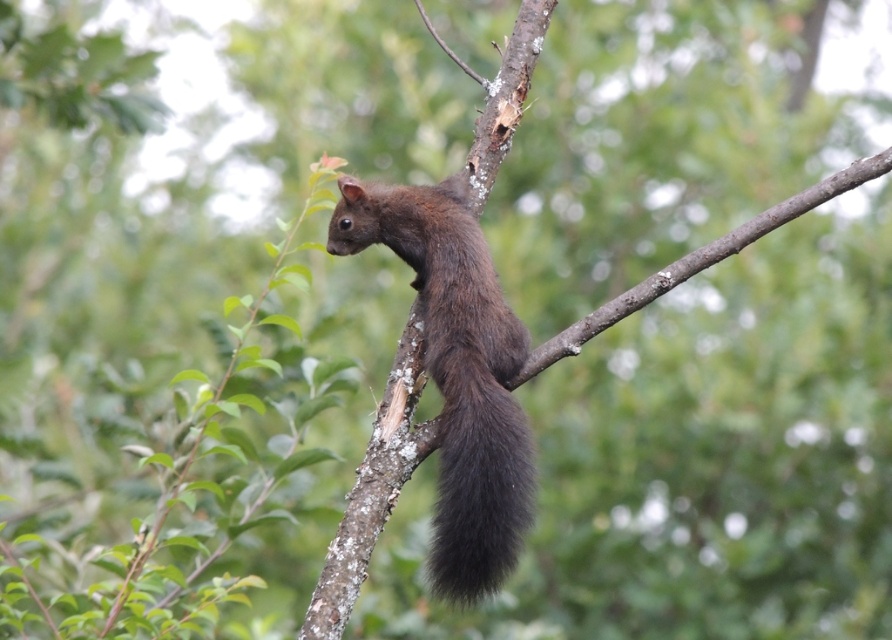
You are a wildlife photographer aiming to capture the shiny brown squirrel at center and its black fuzzy tail at center in a closeup shot. Based on their sizes, which one should you focus on to ensure both are in frame without cropping?

The shiny brown squirrel at center is wider than the black fuzzy tail at center, so focusing on the squirrel ensures both are in frame without cropping.

You are an animal photographer aiming to capture the shiny brown squirrel at center and the black fuzzy tail at center in a single frame. Based on their positions, can you tell if the squirrel is sitting on top of its tail?

The shiny brown squirrel at center is positioned over black fuzzy tail at center, so yes, the squirrel is sitting on top of its tail.

What are the coordinates of the shiny brown squirrel at center?

The shiny brown squirrel at center is located at point (456, 372).